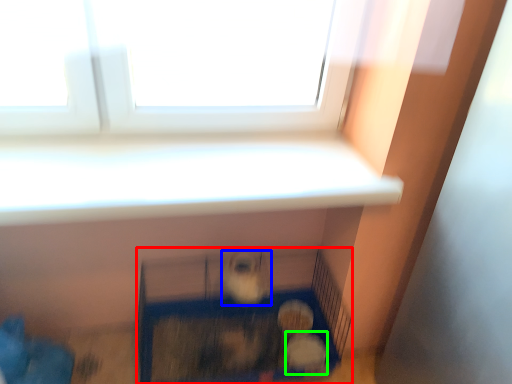
Question: Estimate the real-world distances between objects in this image. Which object is closer to furniture (highlighted by a red box), animal (highlighted by a blue box) or animal (highlighted by a green box)?

Choices:
 (A) animal
 (B) animal

Answer: (A)